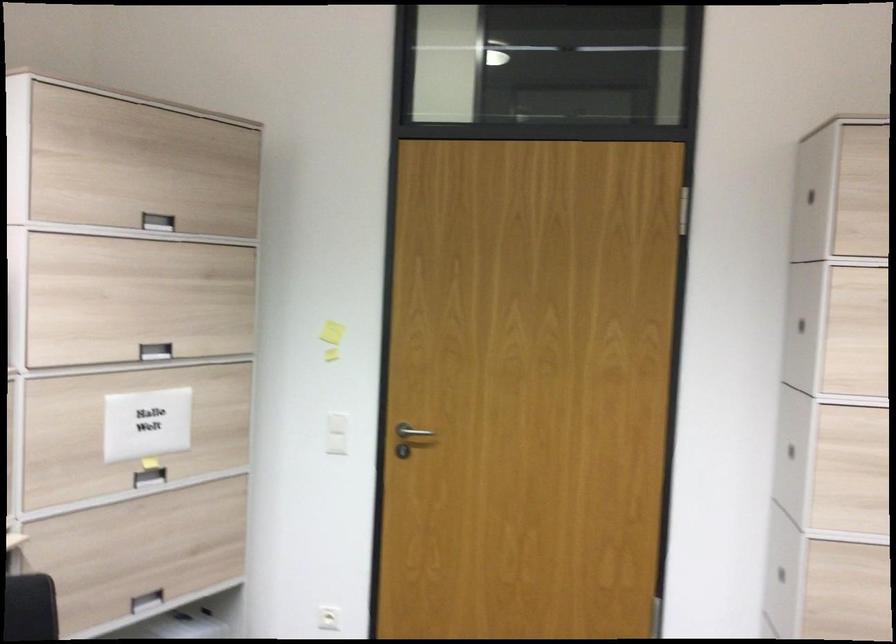
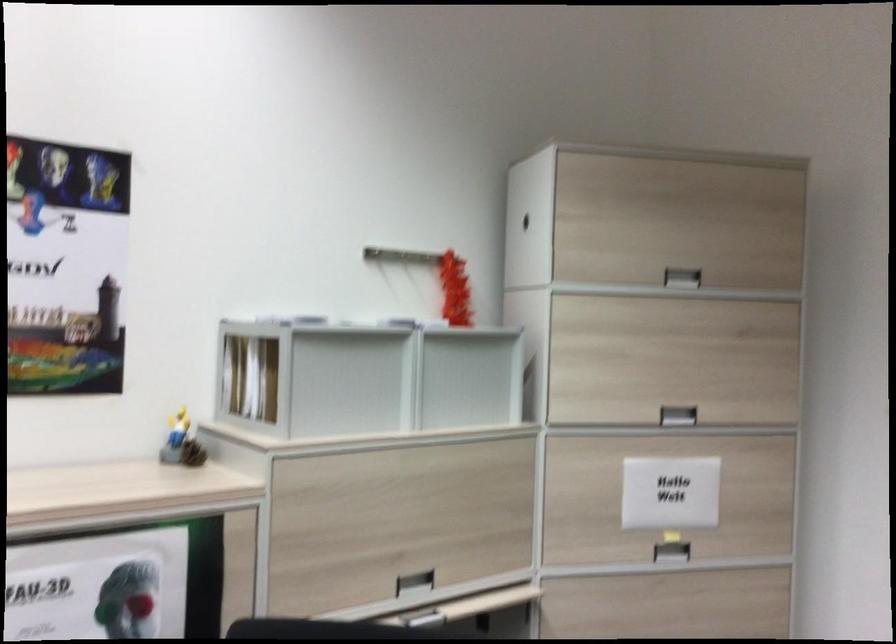
Where in the second image is the point corresponding to pixel 149 478 from the first image?

(670, 552)